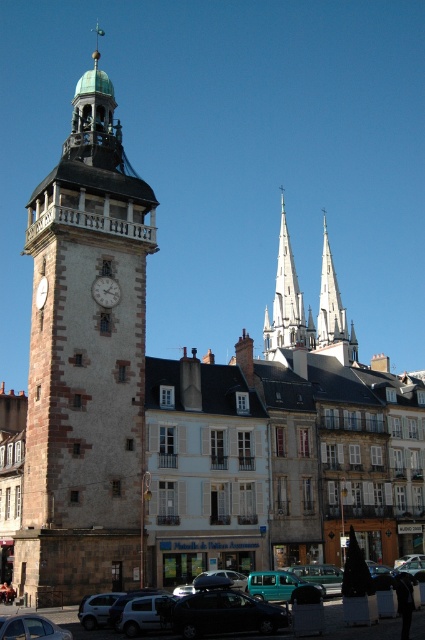
Question: Which point is farther from the camera taking this photo?

Choices:
 (A) (39, 289)
 (B) (17, 621)
 (C) (269, 339)
 (D) (294, 586)

Answer: (C)

Question: Which of the following is the closest to the observer?

Choices:
 (A) (81, 141)
 (B) (17, 636)
 (C) (45, 291)
 (D) (105, 300)

Answer: (B)

Question: Can you confirm if metallic silver car at lower left is wider than matte white clock at center-left?

Choices:
 (A) no
 (B) yes

Answer: (B)

Question: Can you confirm if brown stone clock tower at left is positioned to the left of matte silver clock at center?

Choices:
 (A) yes
 (B) no

Answer: (A)

Question: Does brown stone clock tower at left have a larger size compared to metallic silver car at lower left?

Choices:
 (A) no
 (B) yes

Answer: (B)

Question: Estimate the real-world distances between objects in this image. Which object is closer to the metallic silver car at lower left?

Choices:
 (A) matte silver clock at center
 (B) brown stone clock tower at left

Answer: (A)